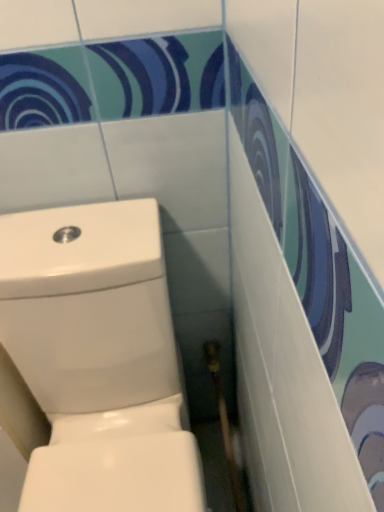
Measure the distance between point (83, 268) and camera.

A distance of 27.01 inches exists between point (83, 268) and camera.

What are the coordinates of `white glossy toilet at lower left` in the screenshot? It's located at (96, 360).

Describe the element at coordinates (96, 360) in the screenshot. The width and height of the screenshot is (384, 512). I see `white glossy toilet at lower left` at that location.

I want to click on white glossy toilet at lower left, so click(x=96, y=360).